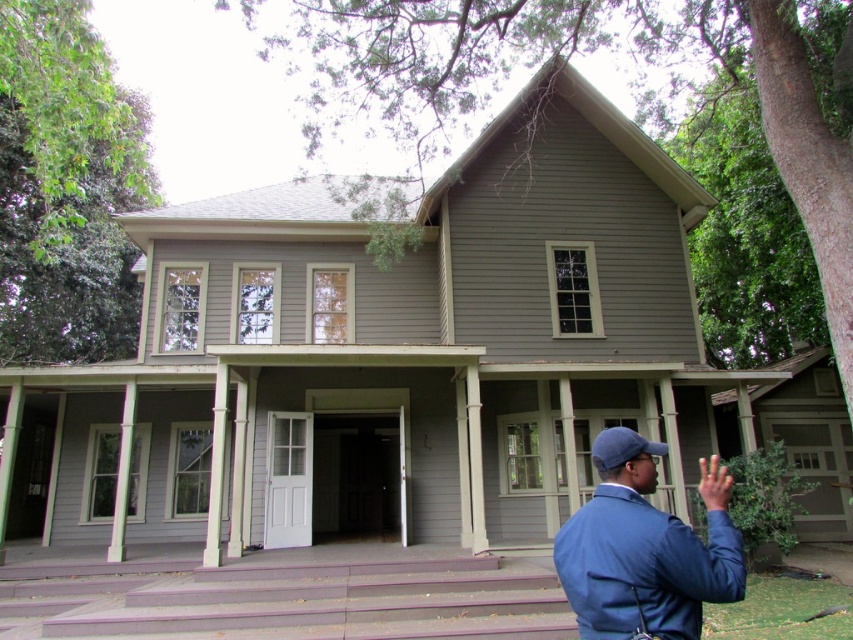
Question: Is blue fabric jacket at lower right to the left of blue fabric baseball cap at center from the viewer's perspective?

Choices:
 (A) no
 (B) yes

Answer: (A)

Question: Based on their relative distances, which object is farther from the blue fabric jacket at lower right?

Choices:
 (A) smooth gray porch at center
 (B) blue fabric baseball cap at center

Answer: (A)

Question: Which object is the farthest from the blue fabric jacket at lower right?

Choices:
 (A) blue fabric baseball cap at center
 (B) smooth gray porch at center

Answer: (B)

Question: Can you confirm if smooth gray porch at center is bigger than blue fabric baseball cap at center?

Choices:
 (A) yes
 (B) no

Answer: (A)

Question: Can you confirm if smooth gray porch at center is smaller than blue fabric baseball cap at center?

Choices:
 (A) no
 (B) yes

Answer: (A)

Question: Which object appears farthest from the camera in this image?

Choices:
 (A) blue fabric jacket at lower right
 (B) smooth gray porch at center

Answer: (B)